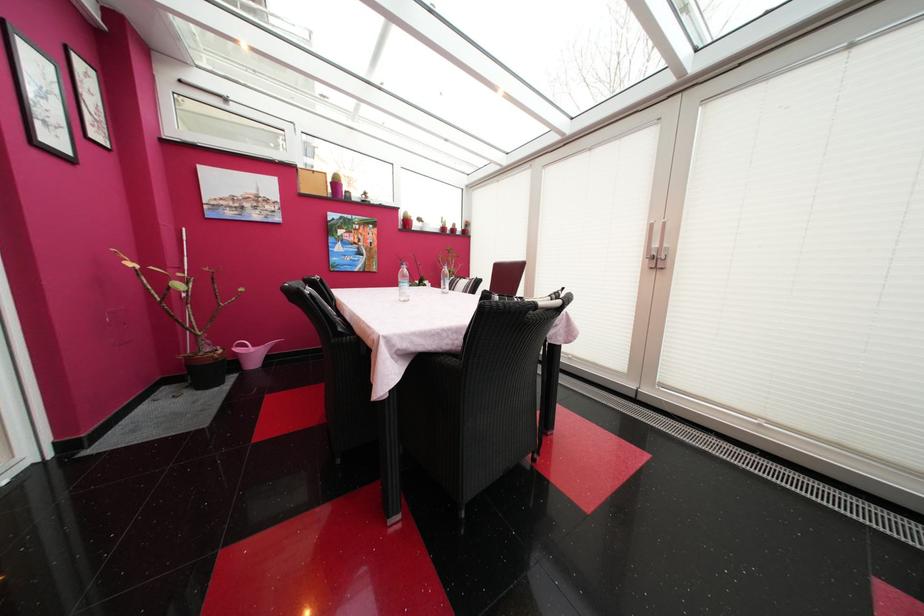
The location [185,278] corresponds to which object?

It corresponds to the white pole in the image.